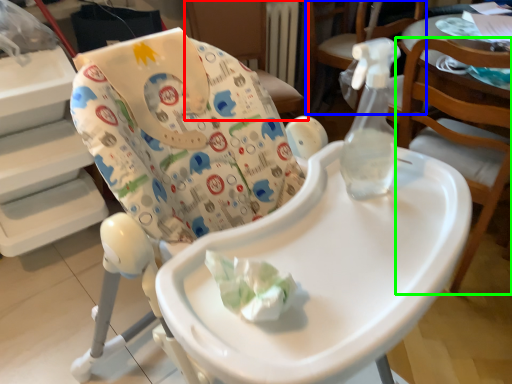
Question: Which object is the farthest from chair (highlighted by a red box)? Choose among these: chair (highlighted by a blue box) or chair (highlighted by a green box).

Choices:
 (A) chair
 (B) chair

Answer: (B)